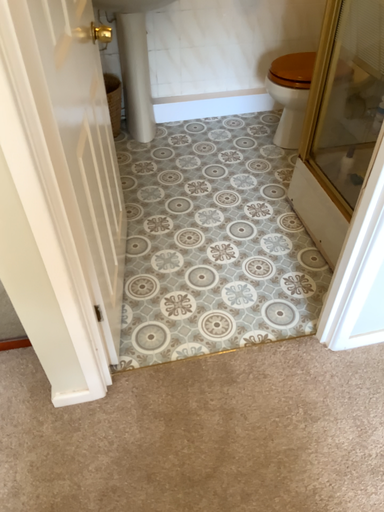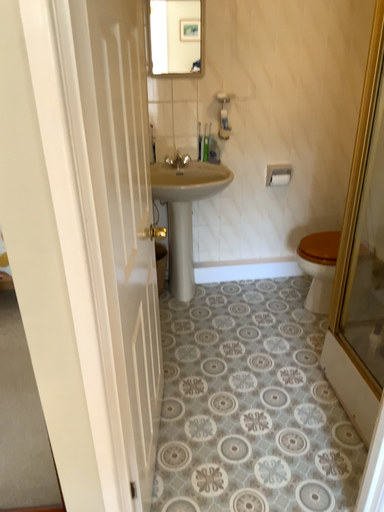
Question: Which way did the camera rotate in the video?

Choices:
 (A) rotated upward
 (B) rotated downward

Answer: (A)